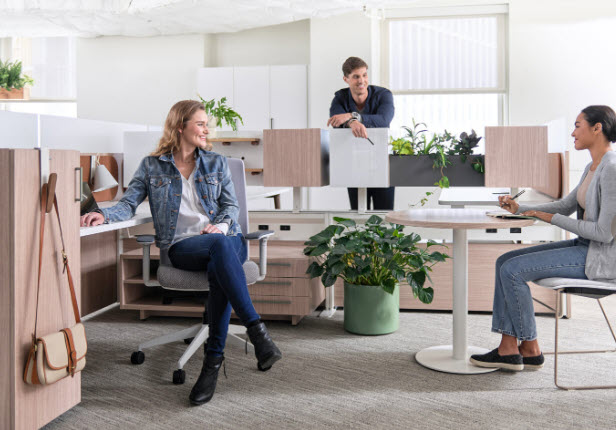
What are the coordinates of `desk` in the screenshot? It's located at (111, 201).